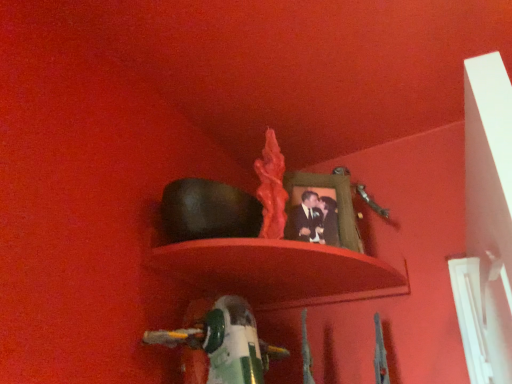
Question: Are green plastic toy at lower center and smooth matte shelf at center far apart?

Choices:
 (A) no
 (B) yes

Answer: (A)

Question: Does green plastic toy at lower center have a lesser height compared to smooth matte shelf at center?

Choices:
 (A) yes
 (B) no

Answer: (B)

Question: Is green plastic toy at lower center further to the viewer compared to smooth matte shelf at center?

Choices:
 (A) no
 (B) yes

Answer: (A)

Question: Is green plastic toy at lower center to the right of smooth matte shelf at center from the viewer's perspective?

Choices:
 (A) yes
 (B) no

Answer: (B)

Question: Does green plastic toy at lower center have a smaller size compared to smooth matte shelf at center?

Choices:
 (A) no
 (B) yes

Answer: (A)

Question: Is green plastic toy at lower center turned away from smooth matte shelf at center?

Choices:
 (A) yes
 (B) no

Answer: (B)

Question: Does matte green picture frame at upper center appear on the right side of smooth matte shelf at center?

Choices:
 (A) no
 (B) yes

Answer: (B)

Question: Considering the relative sizes of matte green picture frame at upper center and smooth matte shelf at center in the image provided, is matte green picture frame at upper center bigger than smooth matte shelf at center?

Choices:
 (A) yes
 (B) no

Answer: (B)

Question: Could you tell me if matte green picture frame at upper center is turned towards smooth matte shelf at center?

Choices:
 (A) no
 (B) yes

Answer: (A)

Question: From the image's perspective, is matte green picture frame at upper center located beneath smooth matte shelf at center?

Choices:
 (A) yes
 (B) no

Answer: (B)

Question: Does matte green picture frame at upper center appear on the left side of smooth matte shelf at center?

Choices:
 (A) yes
 (B) no

Answer: (B)

Question: Can you confirm if matte green picture frame at upper center is taller than smooth matte shelf at center?

Choices:
 (A) yes
 (B) no

Answer: (A)

Question: Does smooth matte shelf at center have a smaller size compared to matte green picture frame at upper center?

Choices:
 (A) no
 (B) yes

Answer: (A)